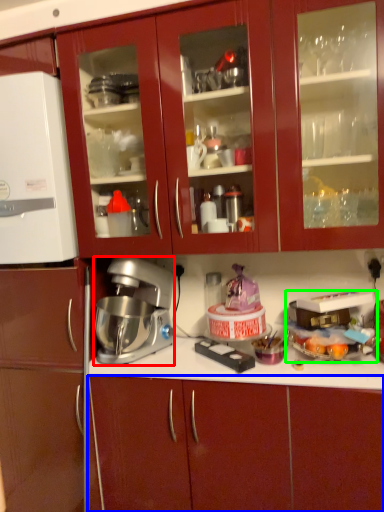
Question: Based on their relative distances, which object is farther from mixer (highlighted by a red box)? Choose from cabinetry (highlighted by a blue box) and appliance (highlighted by a green box).

Choices:
 (A) cabinetry
 (B) appliance

Answer: (B)